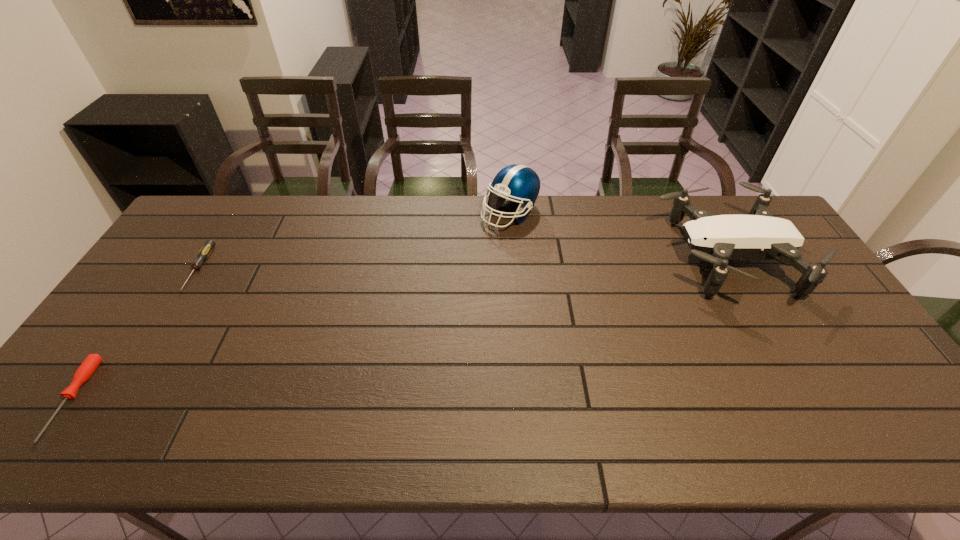
Where is `vacant point located between the rightmost object and the third object from right to left`? Image resolution: width=960 pixels, height=540 pixels. vacant point located between the rightmost object and the third object from right to left is located at coordinates (463, 264).

Locate an element on the screen. This screenshot has width=960, height=540. unoccupied area between the third shortest object and the football helmet is located at coordinates (618, 235).

Locate an element on the screen. free spot between the second tallest object and the second object from right to left is located at coordinates (618, 235).

Select which object is the closest to the farther screwdriver. Please provide its 2D coordinates. Your answer should be formatted as a tuple, i.e. [(x, y)], where the tuple contains the x and y coordinates of a point satisfying the conditions above.

[(87, 368)]

You are a GUI agent. You are given a task and a screenshot of the screen. Output one action in this format:
    pyautogui.click(x=<x>, y=<y>)
    Task: Click on the closest object relative to the rightmost object
    This screenshot has height=540, width=960.
    Given the screenshot: What is the action you would take?
    pyautogui.click(x=519, y=183)

At what (x,y) coordinates should I click in order to perform the action: click on vacant area in the image that satisfies the following two spatial constraints: 1. on the camera side of the second tallest object; 2. at the tip of the left screwdriver. Please return your answer as a coordinate pair (x, y). This screenshot has width=960, height=540. Looking at the image, I should click on (807, 399).

The height and width of the screenshot is (540, 960). I want to click on vacant region that satisfies the following two spatial constraints: 1. on the camera side of the drone; 2. at the tip of the nearer screwdriver, so click(807, 399).

Find the location of a particular element. vacant area in the image that satisfies the following two spatial constraints: 1. on the camera side of the drone; 2. insert the right screwdriver into a screw head is located at coordinates (733, 269).

The height and width of the screenshot is (540, 960). What are the coordinates of `free spot that satisfies the following two spatial constraints: 1. on the camera side of the rightmost object; 2. insert the right screwdriver into a screw head` in the screenshot? It's located at coord(733,269).

The width and height of the screenshot is (960, 540). What are the coordinates of `vacant position in the image that satisfies the following two spatial constraints: 1. on the camera side of the rightmost object; 2. at the tip of the nearest object` in the screenshot? It's located at (807, 399).